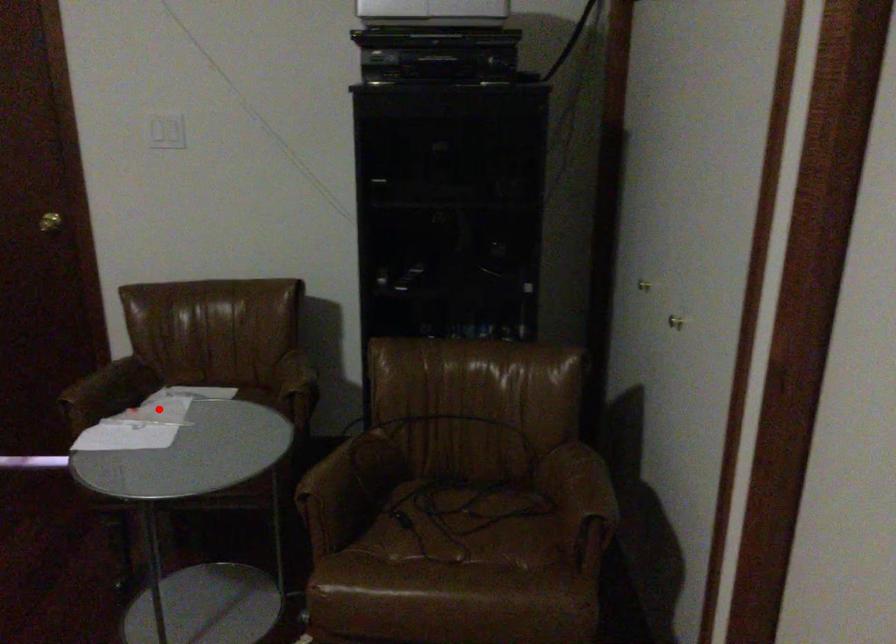
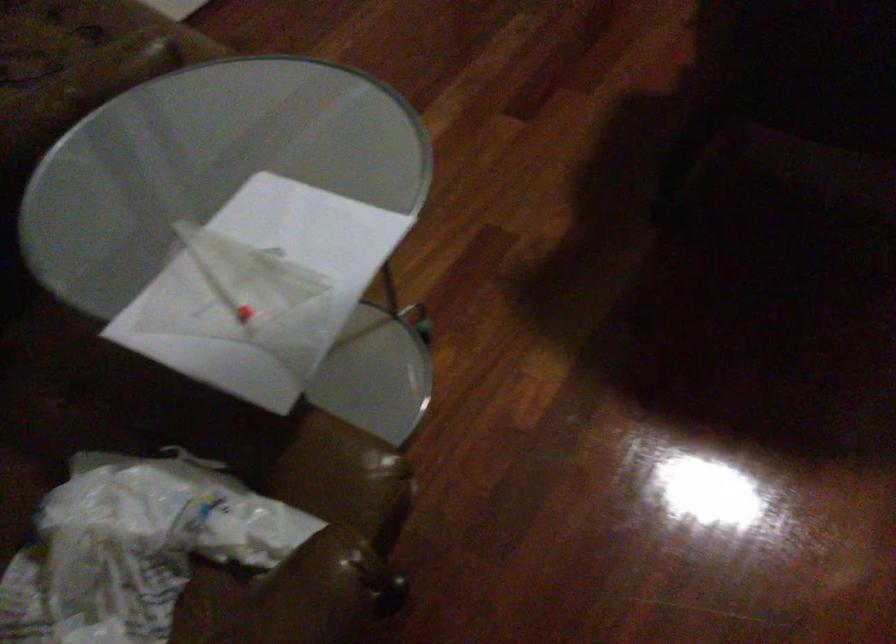
Question: I am providing you with two images of the same scene from different viewpoints. Image1 has a red point marked. In image2, the corresponding 3D location appears at what relative position? Reply with the corresponding letter.

Choices:
 (A) Closer
 (B) Farther

Answer: (A)